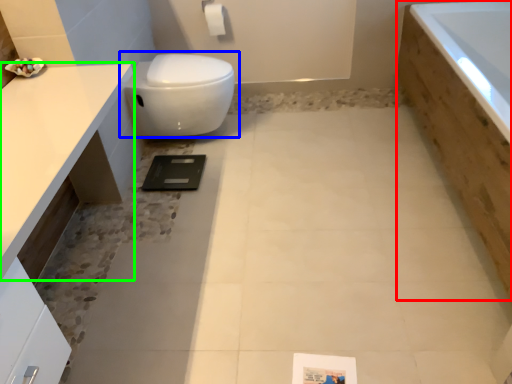
Question: Which object is positioned farthest from bath (highlighted by a red box)? Select from toilet (highlighted by a blue box) and countertop (highlighted by a green box).

Choices:
 (A) toilet
 (B) countertop

Answer: (B)